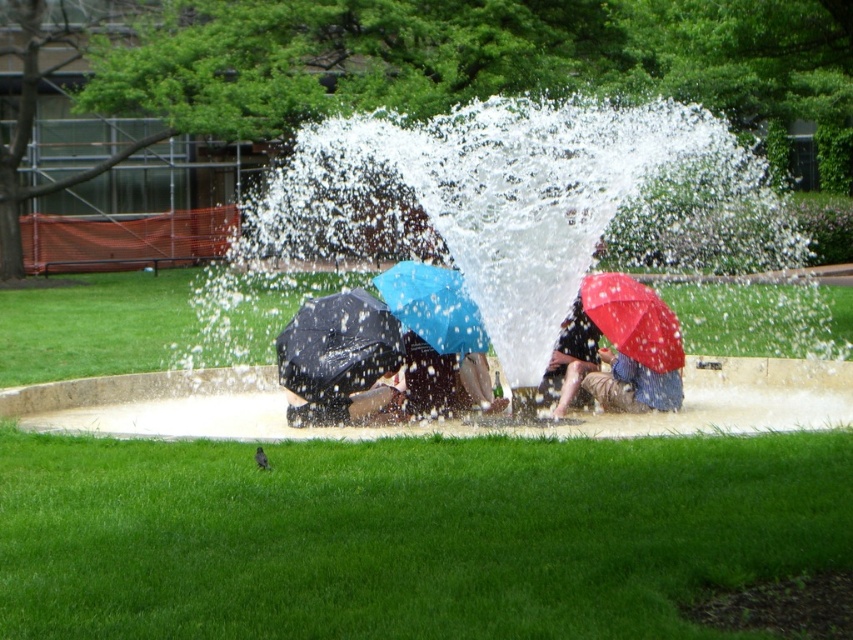
You are a photographer trying to capture a clear shot of the blue matte umbrella at center without the white frothy water at center obstructing it. Based on their positions, is this possible?

The white frothy water at center is in front of the blue matte umbrella at center, so it would obstruct the view. To get a clear shot of the blue matte umbrella at center, you need to adjust your angle to avoid the white frothy water at center.

Looking at this image, you are standing at the origin point of the coordinate system in the park scene. The fountain is in front of you. You want to place a new yellow umbrella exactly 0.2 units to the right of the matte black umbrella at center. What are the coordinates where you should place the new yellow umbrella?

The coordinates for the new yellow umbrella should be approximately 0.541 plus 0.2 in the x direction, so 0.741, and the y coordinate remains 0.397. So the new coordinates are approximately (338,474).